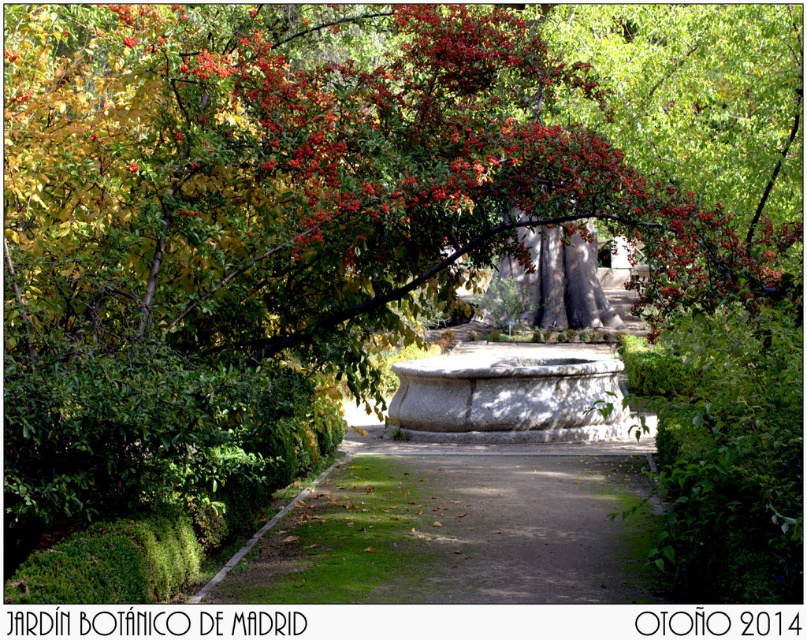
Question: Among these points, which one is farthest from the camera?

Choices:
 (A) (672, 266)
 (B) (423, 488)
 (C) (494, 349)

Answer: (C)

Question: Which of these objects is positioned closest to the granite fountain at center?

Choices:
 (A) green glossy leaves at upper center
 (B) green gravel path at center

Answer: (A)

Question: Which of the following is the farthest from the observer?

Choices:
 (A) pos(486,538)
 (B) pos(471,145)

Answer: (A)

Question: Is green glossy leaves at upper center positioned before green gravel path at center?

Choices:
 (A) no
 (B) yes

Answer: (B)

Question: Does green glossy leaves at upper center have a smaller size compared to green gravel path at center?

Choices:
 (A) no
 (B) yes

Answer: (A)

Question: Does green glossy leaves at upper center appear on the right side of green gravel path at center?

Choices:
 (A) yes
 (B) no

Answer: (A)